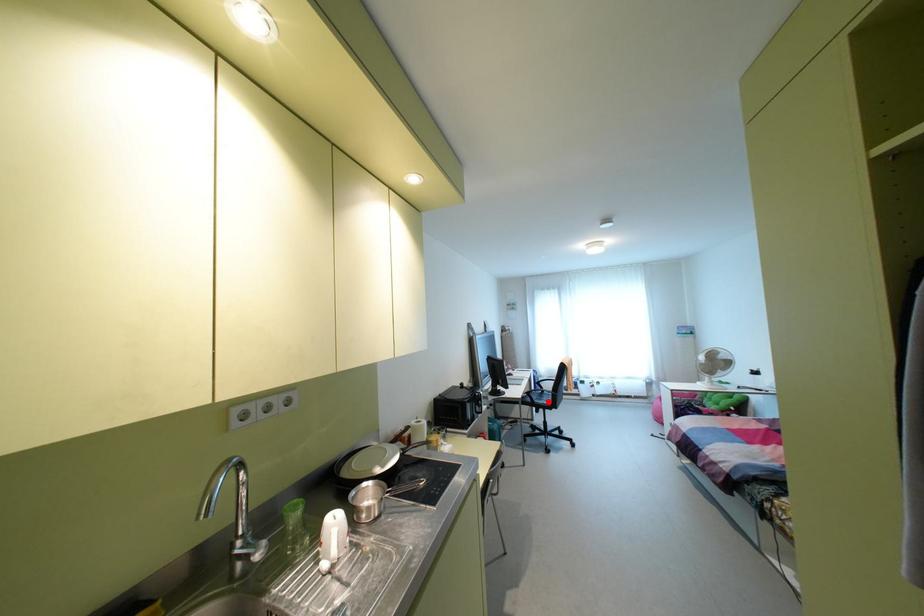
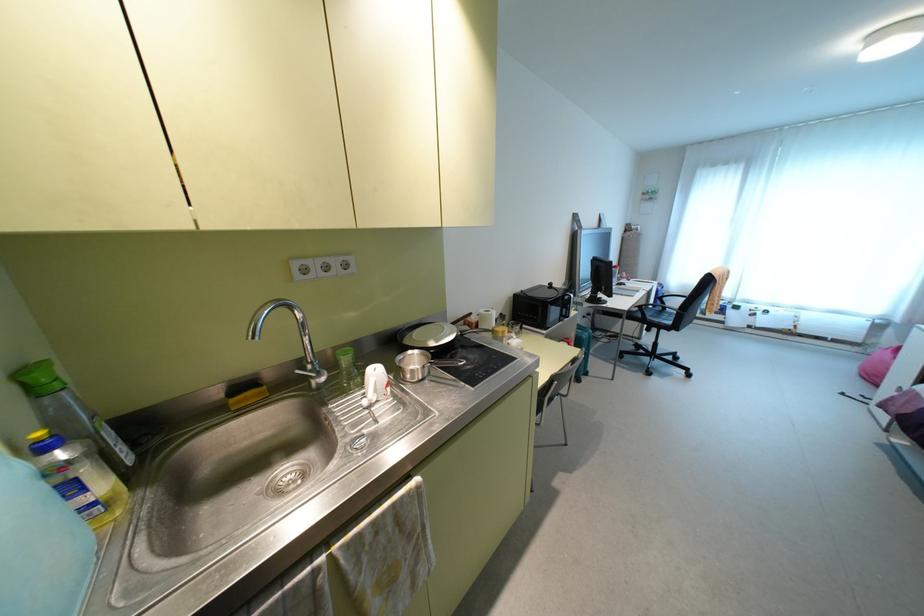
Question: I am providing you with two images of the same scene from different viewpoints. A red point is marked on the first image. Can you still see the location of the red point in image 2?

Choices:
 (A) Yes
 (B) No

Answer: (A)